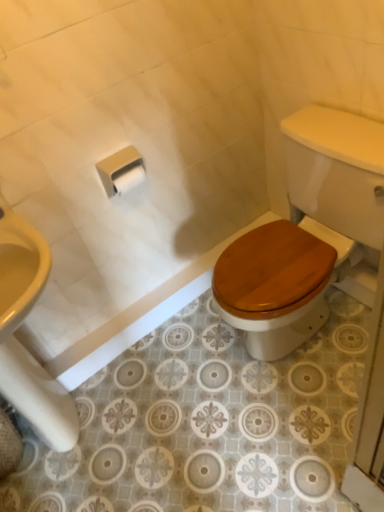
Question: Looking at the image, does white matte toilet paper at center, marked as the 1th toilet paper in a front-to-back arrangement, seem bigger or smaller compared to wooden at lower right?

Choices:
 (A) big
 (B) small

Answer: (B)

Question: Considering the positions of point (134, 173) and point (253, 328), is point (134, 173) closer or farther from the camera than point (253, 328)?

Choices:
 (A) closer
 (B) farther

Answer: (B)

Question: Based on their relative distances, which object is nearer to the wooden at lower right?

Choices:
 (A) white matte toilet paper at center, marked as the 1th toilet paper in a front-to-back arrangement
 (B) white matte toilet paper at upper center, which is counted as the first toilet paper, starting from the back

Answer: (A)

Question: Estimate the real-world distances between objects in this image. Which object is farther from the white matte toilet paper at upper center, which appears as the second toilet paper when viewed from the front?

Choices:
 (A) white matte toilet paper at center, positioned as the second toilet paper in back-to-front order
 (B) wooden at lower right

Answer: (B)